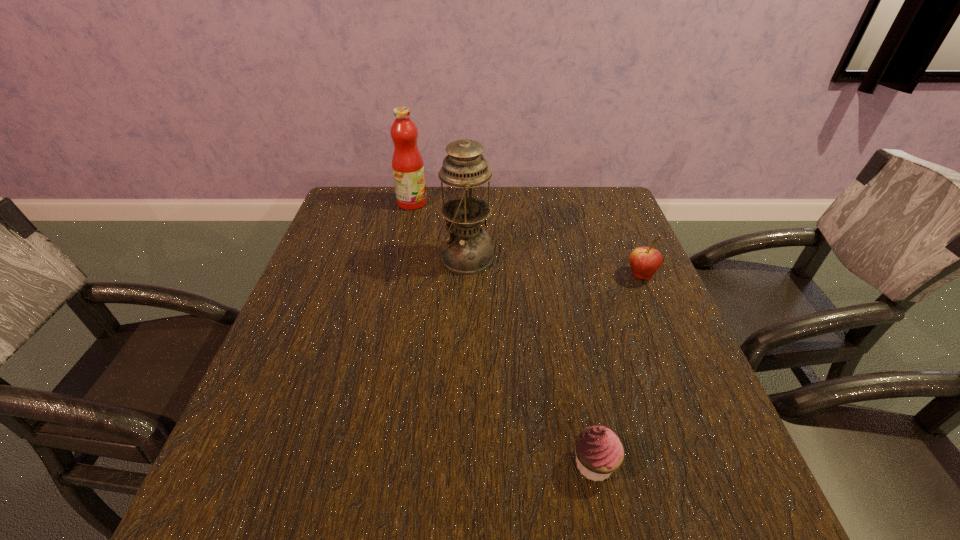
Find the location of a particular element. oil lamp is located at coordinates (466, 249).

This screenshot has width=960, height=540. Find the location of `fruit juice`. fruit juice is located at coordinates (407, 163).

Locate an element on the screen. the leftmost object is located at coordinates (407, 163).

The width and height of the screenshot is (960, 540). I want to click on apple, so click(644, 261).

Where is `the nearest object`? Image resolution: width=960 pixels, height=540 pixels. the nearest object is located at coordinates (599, 452).

The image size is (960, 540). Find the location of `the second object from right to left`. the second object from right to left is located at coordinates (599, 452).

The image size is (960, 540). What are the coordinates of `vacant area situated 0.390m on the right of the oil lamp` in the screenshot? It's located at (641, 258).

This screenshot has height=540, width=960. What are the coordinates of `vacant point located on the front label of the farthest object` in the screenshot? It's located at (501, 202).

Image resolution: width=960 pixels, height=540 pixels. Find the location of `free point located 0.070m on the left of the rightmost object`. free point located 0.070m on the left of the rightmost object is located at coordinates (598, 276).

Identify the location of blank space located 0.210m on the back of the third object from left to right. The image size is (960, 540). (571, 349).